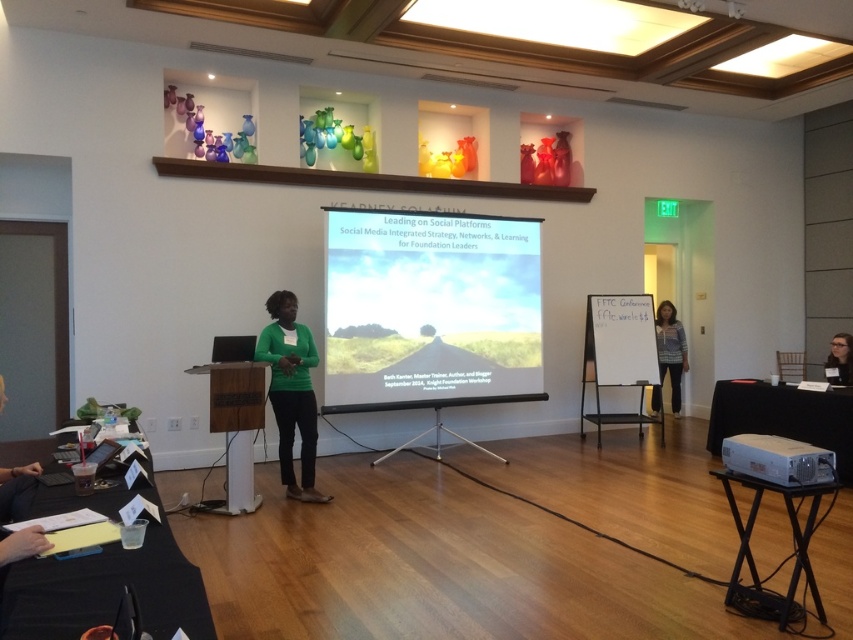
Question: Is the position of green matte shirt at center less distant than that of matte black glasses at upper right?

Choices:
 (A) no
 (B) yes

Answer: (B)

Question: Estimate the real-world distances between objects in this image. Which object is closer to the striped sweater at right?

Choices:
 (A) green matte shirt at center
 (B) matte black glasses at upper right

Answer: (B)

Question: Which point is farther to the camera?

Choices:
 (A) striped sweater at right
 (B) green matte shirt at center
 (C) white plastic projector at lower right

Answer: (A)

Question: Can you confirm if green matte shirt at center is thinner than striped sweater at right?

Choices:
 (A) yes
 (B) no

Answer: (A)

Question: Which point is closer to the camera?

Choices:
 (A) matte black glasses at upper right
 (B) green matte shirt at center
 (C) striped sweater at right
 (D) white plastic projector at lower right

Answer: (D)

Question: Is matte white projector screen at center smaller than green matte shirt at center?

Choices:
 (A) no
 (B) yes

Answer: (A)